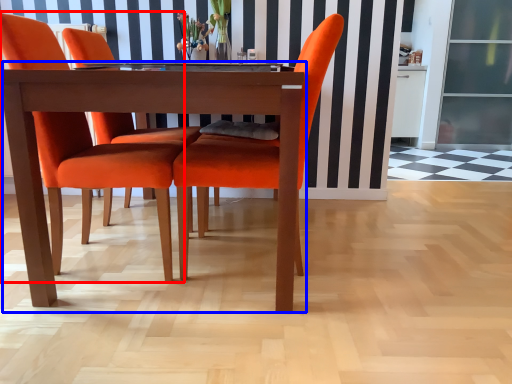
Question: Which point is further to the camera, chair (highlighted by a red box) or kitchen & dining room table (highlighted by a blue box)?

Choices:
 (A) chair
 (B) kitchen & dining room table

Answer: (A)